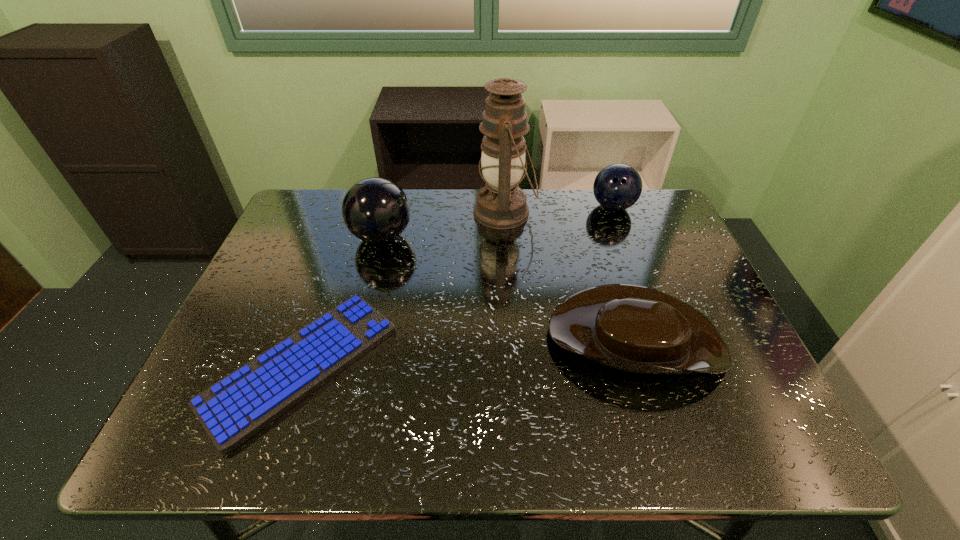
This screenshot has height=540, width=960. I want to click on the tallest object, so click(501, 204).

Find the location of a particular element. The height and width of the screenshot is (540, 960). the fourth shortest object is located at coordinates click(x=375, y=210).

This screenshot has height=540, width=960. Find the location of `the taller bowling ball`. the taller bowling ball is located at coordinates (375, 210).

Image resolution: width=960 pixels, height=540 pixels. Identify the location of the right bowling ball. (618, 186).

Where is `the shorter bowling ball`? The width and height of the screenshot is (960, 540). the shorter bowling ball is located at coordinates (618, 186).

Where is `the fourth tallest object`? The height and width of the screenshot is (540, 960). the fourth tallest object is located at coordinates (631, 328).

Image resolution: width=960 pixels, height=540 pixels. In order to click on the shortest object in this screenshot , I will do `click(235, 408)`.

Where is `blank space located on the left of the tallest object`? The height and width of the screenshot is (540, 960). blank space located on the left of the tallest object is located at coordinates (350, 213).

Locate an element on the screen. vacant region located 0.320m on the side of the left bowling ball with the finger holes is located at coordinates tap(526, 237).

You are a GUI agent. You are given a task and a screenshot of the screen. Output one action in this format:
    pyautogui.click(x=<x>, y=<y>)
    Task: Click on the vacant space situated on the surface of the third shortest object near the finger holes
    
    Given the screenshot: What is the action you would take?
    pyautogui.click(x=657, y=325)